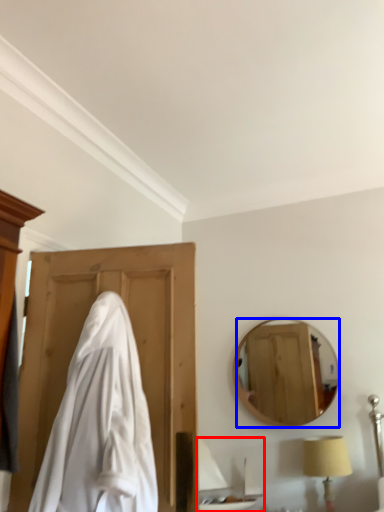
Question: Which of the following is the farthest to the observer, sink (highlighted by a red box) or mirror (highlighted by a blue box)?

Choices:
 (A) sink
 (B) mirror

Answer: (B)